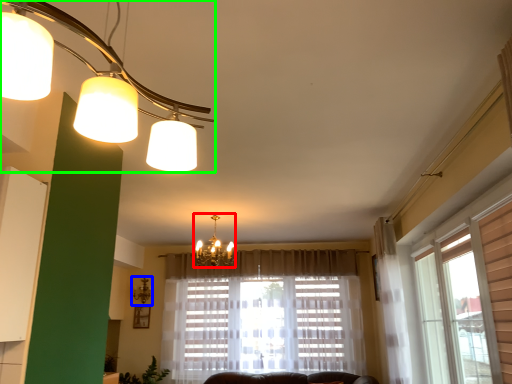
Question: Which object is the farthest from lamp (highlighted by a red box)? Choose among these: lamp (highlighted by a blue box) or lamp (highlighted by a green box).

Choices:
 (A) lamp
 (B) lamp

Answer: (B)